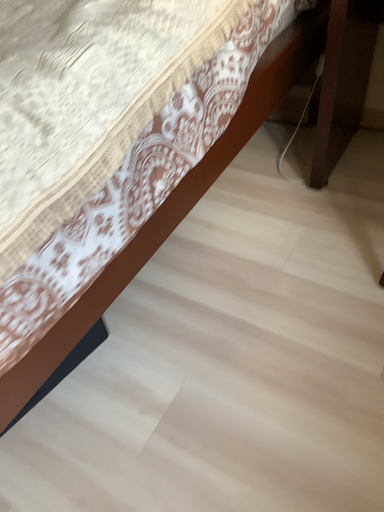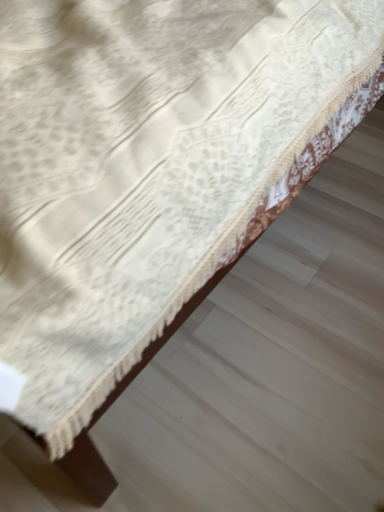
Question: How did the camera likely rotate when shooting the video?

Choices:
 (A) rotated upward
 (B) rotated downward

Answer: (B)